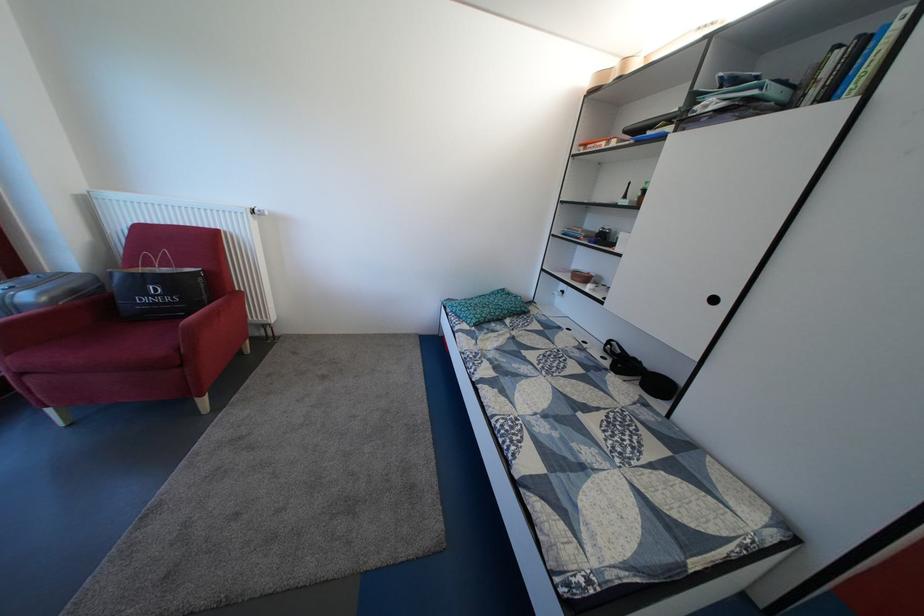
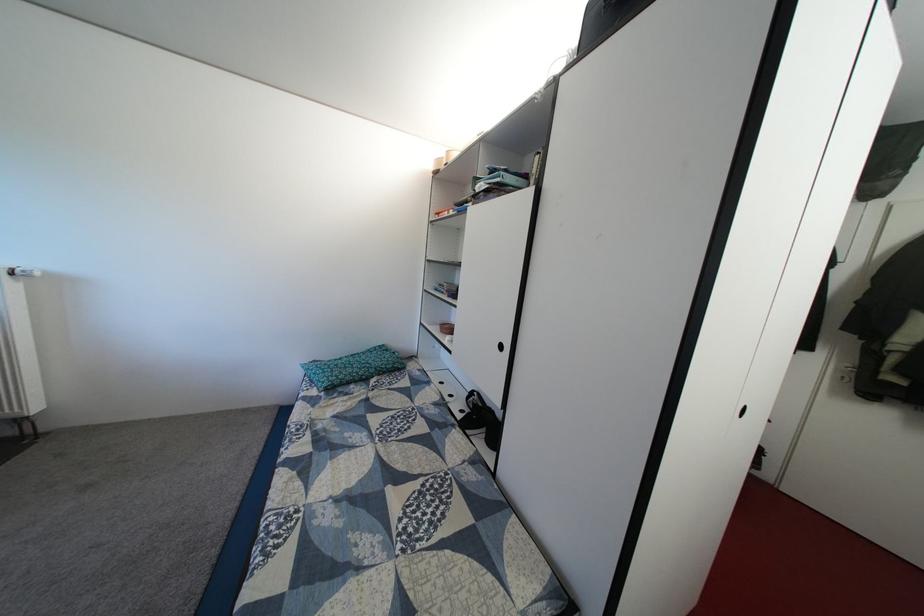
Question: In a continuous first-person perspective shot, in which direction is the camera moving?

Choices:
 (A) Left
 (B) Right
 (C) Forward
 (D) Backward

Answer: (B)